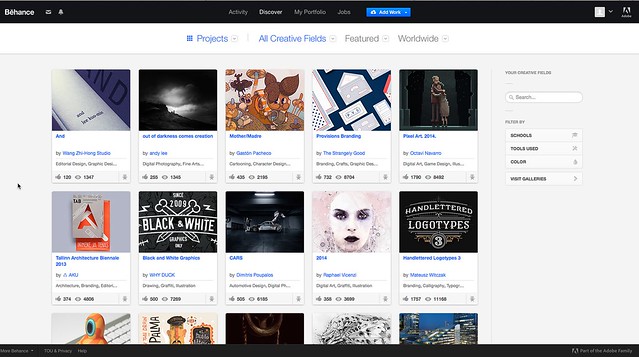
You are a GUI agent. You are given a task and a screenshot of the screen. Output one action in this format:
    pyautogui.click(x=<x>, y=<y>)
    Task: Click on the illustration of a keyboard
    This screenshot has width=639, height=357.
    Given the screenshot: What is the action you would take?
    pyautogui.click(x=118, y=333)